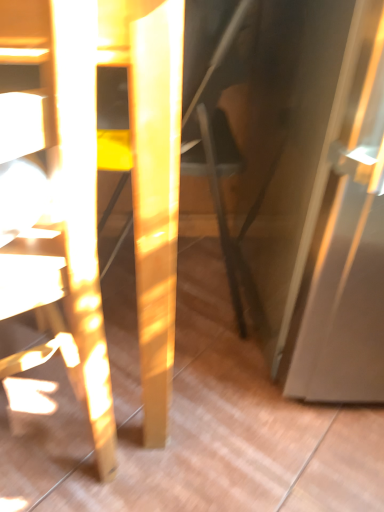
Question: From the image's perspective, is matte yellow chair at left beneath matte black swivel chair at center?

Choices:
 (A) no
 (B) yes

Answer: (B)

Question: Can matte black swivel chair at center be found inside matte yellow chair at left?

Choices:
 (A) yes
 (B) no

Answer: (B)

Question: From a real-world perspective, is matte yellow chair at left under matte black swivel chair at center?

Choices:
 (A) no
 (B) yes

Answer: (B)

Question: Is matte yellow chair at left placed right next to matte black swivel chair at center?

Choices:
 (A) no
 (B) yes

Answer: (A)

Question: Does matte yellow chair at left have a smaller size compared to matte black swivel chair at center?

Choices:
 (A) yes
 (B) no

Answer: (B)

Question: From the image's perspective, is matte yellow chair at left over matte black swivel chair at center?

Choices:
 (A) yes
 (B) no

Answer: (B)

Question: Is matte black swivel chair at center to the right of matte yellow chair at left from the viewer's perspective?

Choices:
 (A) no
 (B) yes

Answer: (B)

Question: Is matte black swivel chair at center oriented towards matte yellow chair at left?

Choices:
 (A) no
 (B) yes

Answer: (A)

Question: Can you confirm if matte black swivel chair at center is bigger than matte yellow chair at left?

Choices:
 (A) no
 (B) yes

Answer: (A)

Question: Does matte black swivel chair at center have a greater height compared to matte yellow chair at left?

Choices:
 (A) yes
 (B) no

Answer: (B)

Question: Is matte black swivel chair at center smaller than matte yellow chair at left?

Choices:
 (A) yes
 (B) no

Answer: (A)

Question: Is matte black swivel chair at center looking in the opposite direction of matte yellow chair at left?

Choices:
 (A) no
 (B) yes

Answer: (A)

Question: Considering the positions of matte black swivel chair at center and matte yellow chair at left in the image, is matte black swivel chair at center wider or thinner than matte yellow chair at left?

Choices:
 (A) thin
 (B) wide

Answer: (A)